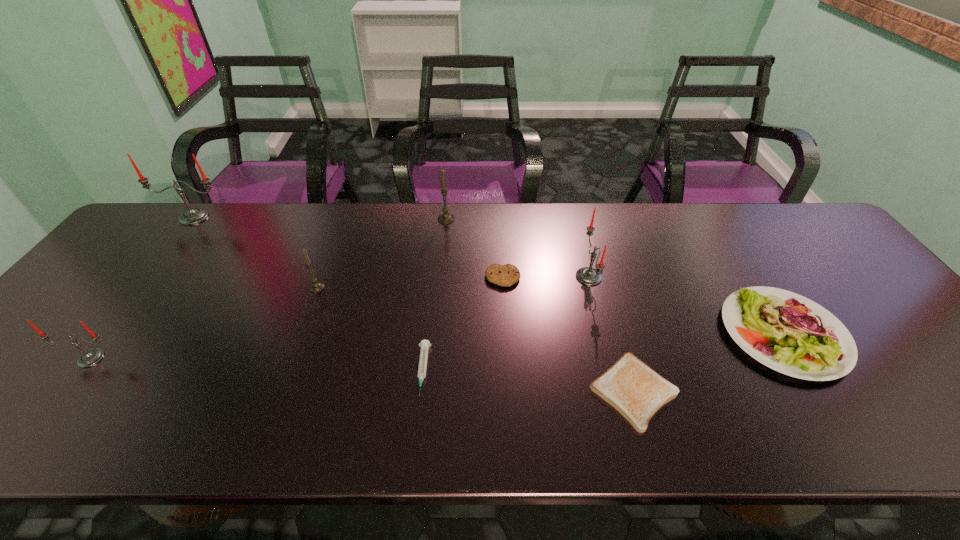
Locate an element on the screen. The image size is (960, 540). the sixth tallest object is located at coordinates (789, 333).

The width and height of the screenshot is (960, 540). In order to click on green salad plate in this screenshot , I will do `click(789, 333)`.

Image resolution: width=960 pixels, height=540 pixels. What are the coordinates of `brown cookie` in the screenshot? It's located at (506, 275).

At what (x,y) coordinates should I click in order to perform the action: click on the fourth object from right to left. Please return your answer as a coordinate pair (x, y). Looking at the image, I should click on (506, 275).

Where is `syringe`? The width and height of the screenshot is (960, 540). syringe is located at coordinates (x=425, y=344).

At what (x,y) coordinates should I click in order to perform the action: click on the eighth tallest object. Please return your answer as a coordinate pair (x, y). Looking at the image, I should click on (425, 344).

What are the coordinates of `the shortest object` in the screenshot? It's located at (635, 390).

At what (x,y) coordinates should I click in order to perform the action: click on vacant position located on the front-facing side of the tallest candle. Please return your answer as a coordinate pair (x, y). Image resolution: width=960 pixels, height=540 pixels. Looking at the image, I should click on (129, 300).

I want to click on vacant space located on the front-facing side of the rightmost red candle, so click(543, 277).

Where is `vacant space located 0.220m on the front-facing side of the rightmost red candle`? The image size is (960, 540). vacant space located 0.220m on the front-facing side of the rightmost red candle is located at coordinates (495, 277).